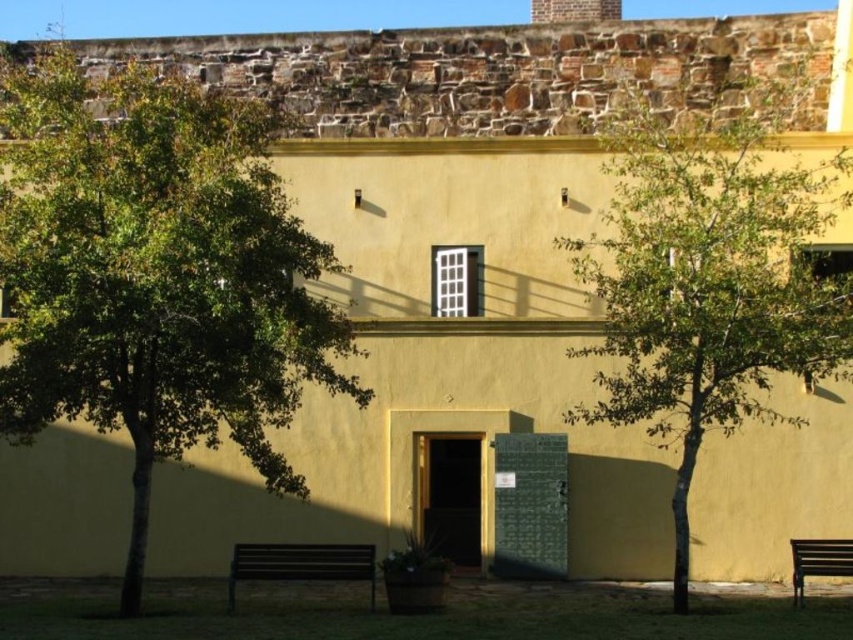
Based on the photo, does green leafy tree at left appear on the left side of brown wooden bench at lower center?

Correct, you'll find green leafy tree at left to the left of brown wooden bench at lower center.

Is point (283, 204) positioned after point (323, 556)?

Yes, point (283, 204) is farther from viewer.

Where is `green leafy tree at left`? The width and height of the screenshot is (853, 640). green leafy tree at left is located at coordinates (154, 272).

Who is positioned more to the left, green leafy tree at left or green leafy tree at center?

green leafy tree at left is more to the left.

Can you confirm if green leafy tree at left is taller than green leafy tree at center?

Yes, green leafy tree at left is taller than green leafy tree at center.

The height and width of the screenshot is (640, 853). Find the location of `green leafy tree at left`. green leafy tree at left is located at coordinates pyautogui.click(x=154, y=272).

This screenshot has height=640, width=853. What are the coordinates of `green leafy tree at left` in the screenshot? It's located at (154, 272).

Which of these two, green leafy tree at center or brown wooden bench at lower center, stands shorter?

Standing shorter between the two is brown wooden bench at lower center.

Is point (633, 184) farther from viewer compared to point (283, 552)?

Yes, it is behind point (283, 552).

Identify the location of green leafy tree at center. This screenshot has height=640, width=853. coord(711,275).